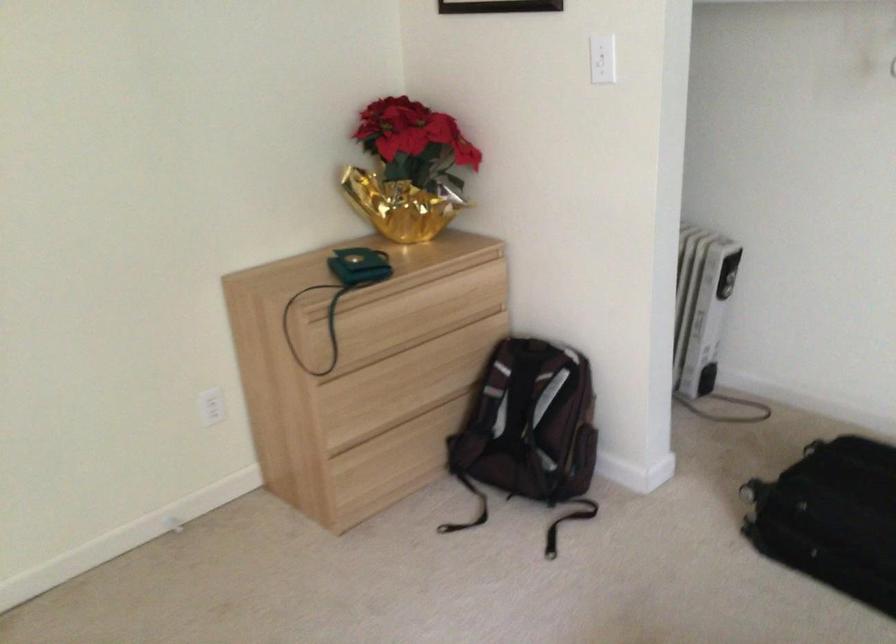
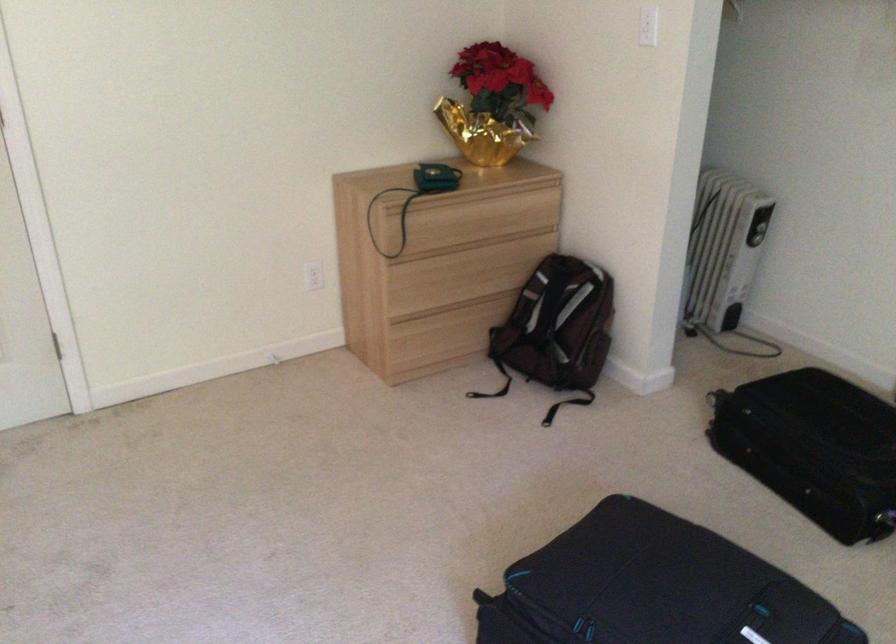
Find the pixel in the second image that matches (x=392, y=471) in the first image.

(442, 345)